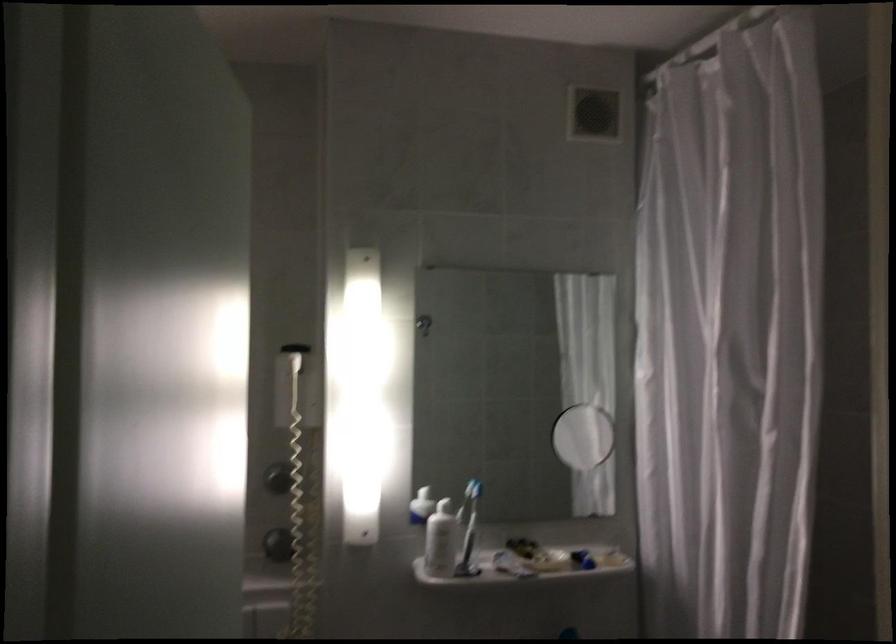
The location [469,529] corresponds to which object?

This point indicates the blue toothbrush.